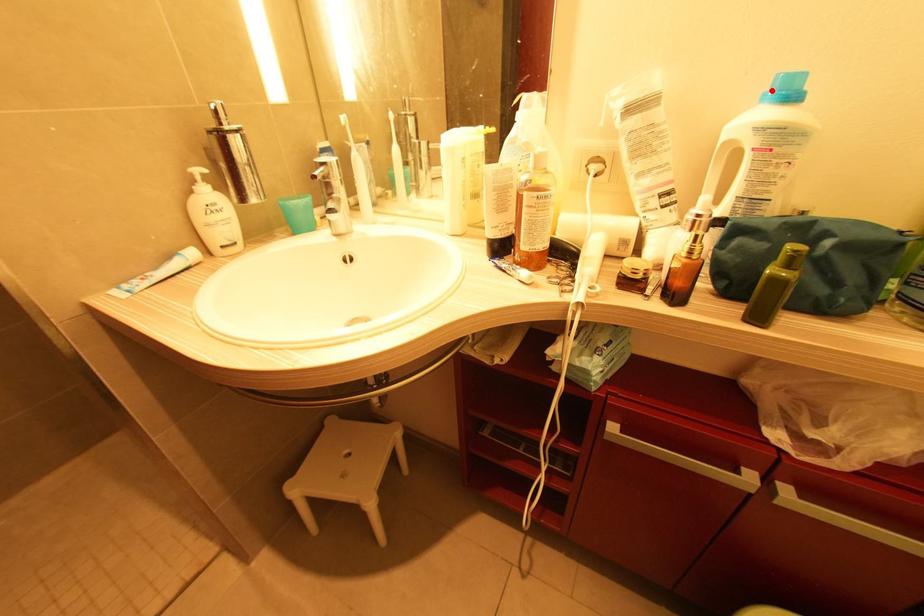
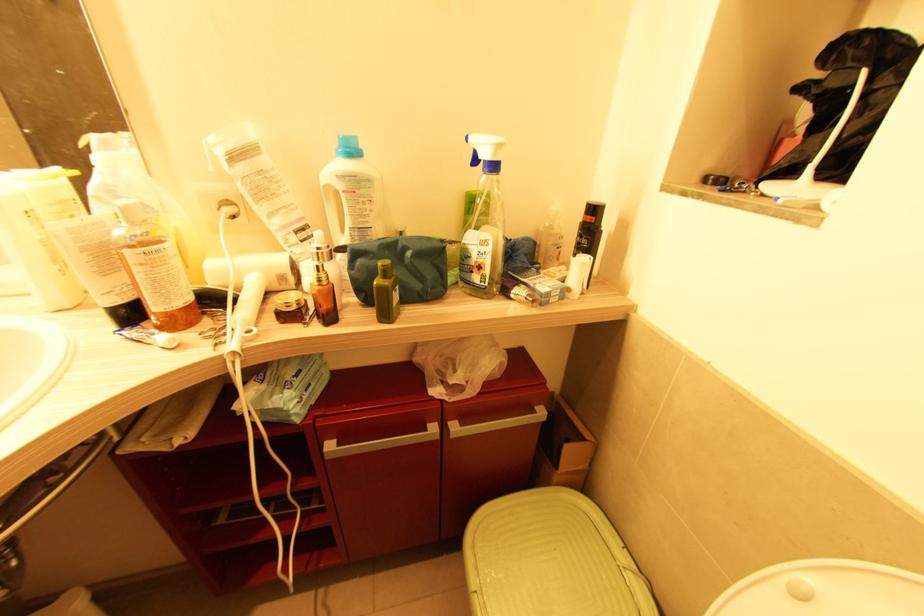
Find the pixel in the second image that matches the highlighted location in the first image.

(341, 148)